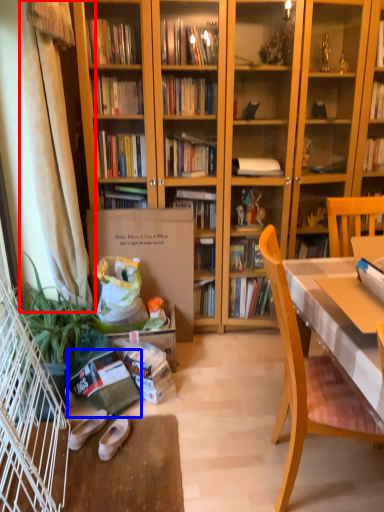
Question: Which of the following is the closest to the observer, curtain (highlighted by a red box) or paperback book (highlighted by a blue box)?

Choices:
 (A) curtain
 (B) paperback book

Answer: (A)